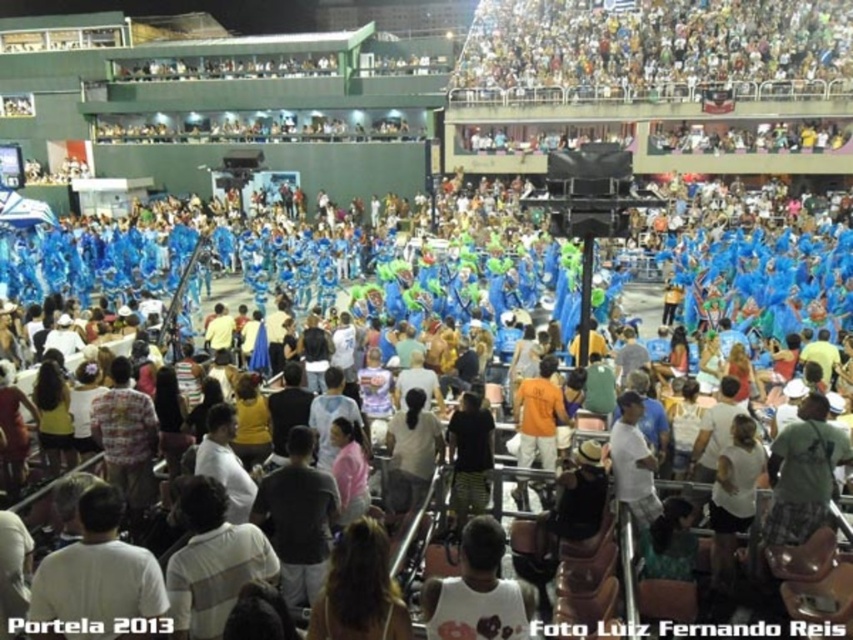
You are a photographer positioned at the origin point of the image coordinate system. You need to capture a photo of the multicolored fabric crowd at upper center. What are the coordinates where you should aim your camera?

The multicolored fabric crowd at upper center is located at coordinates point (653, 49), so you should aim your camera at those coordinates to capture the subject.

You are a photographer at the carnival stage. You want to take a photo of both the white cotton tank top at center and the orange cotton shirt at center. Which one will appear larger in the photo?

The white cotton tank top at center will appear larger in the photo because it is closer to the viewer than the orange cotton shirt at center.